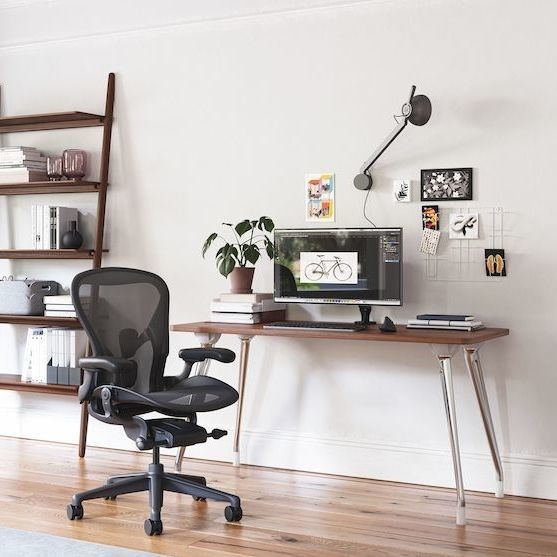
At what (x,y) coordinates should I click in order to perform the action: click on ceiling. Please return your answer as a coordinate pair (x, y). Looking at the image, I should click on (60, 6).